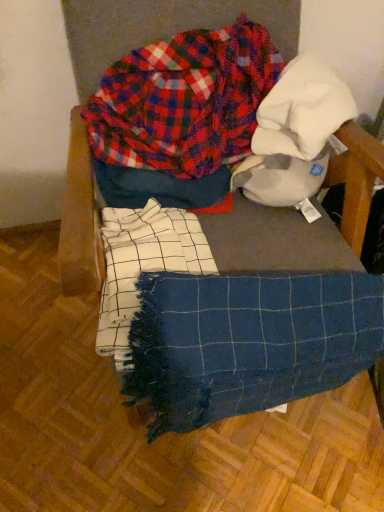
Question: From a real-world perspective, is blue woven blanket at center positioned above or below blue woven blanket at center?

Choices:
 (A) above
 (B) below

Answer: (A)

Question: Visually, is blue woven blanket at center positioned to the left or to the right of blue woven blanket at center?

Choices:
 (A) right
 (B) left

Answer: (B)

Question: Which object is positioned closest to the plaid fabric at upper center?

Choices:
 (A) blue woven blanket at center
 (B) blue woven blanket at center

Answer: (B)

Question: Estimate the real-world distances between objects in this image. Which object is farther from the plaid fabric at upper center?

Choices:
 (A) blue woven blanket at center
 (B) blue woven blanket at center

Answer: (B)